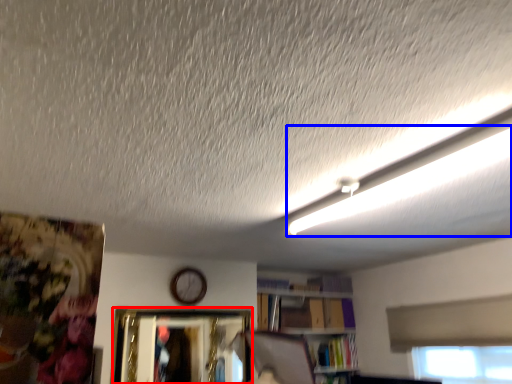
Question: Which object is further to the camera taking this photo, picture frame (highlighted by a red box) or lighting (highlighted by a blue box)?

Choices:
 (A) picture frame
 (B) lighting

Answer: (A)